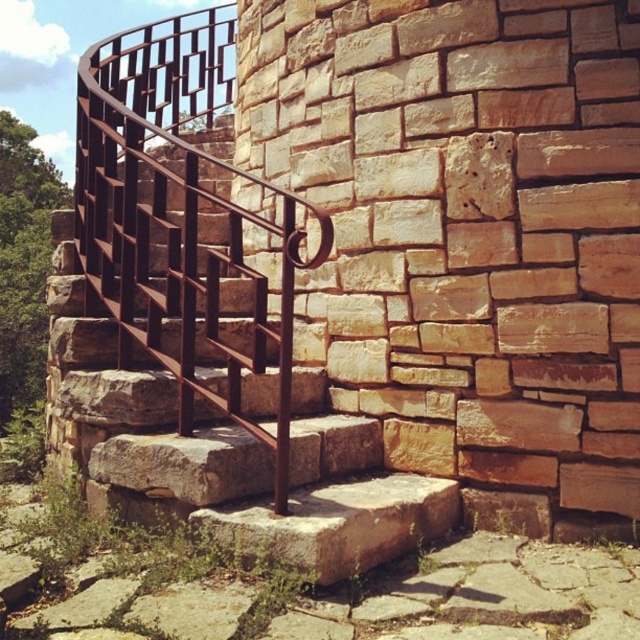
You are a maintenance worker who needs to check the distance between the rusty metal stairwell at center and the rusty metal railing at center. According to safety regulations, the minimum clearance between stairwell and railing must be at least 25 inches. Is the current distance compliant with the safety standards?

The rusty metal stairwell at center and rusty metal railing at center are 24.98 inches apart, which is just below the required 25 inches. Therefore, the current distance does not comply with the safety standards and requires adjustment.

You are standing at the bottom of the spiral staircase and want to reach the top. Which object, the rusty metal stairwell at center or the rusty metal railing at center, will you interact with first as you climb upward?

The rusty metal stairwell at center is taller than the rusty metal railing at center, so you will interact with the rusty metal stairwell at center first as you climb upward.

You are standing at the bottom of the spiral staircase and want to reach the top. Which object, the rusty metal stairwell at center or the rusty metal railing at center, is positioned to the left of the other?

The rusty metal stairwell at center is to the left of the rusty metal railing at center.